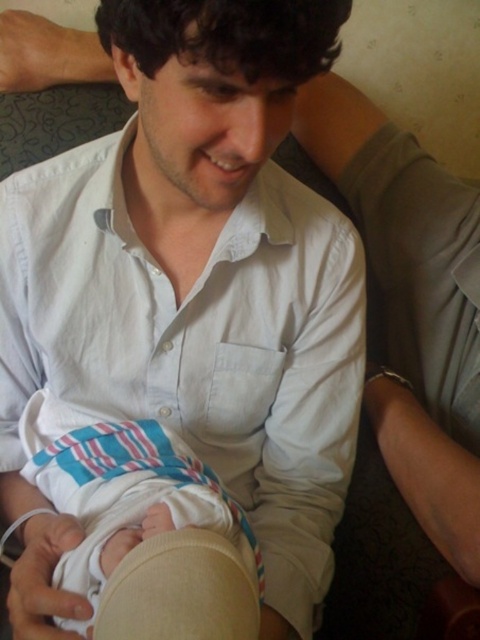
Question: In this image, where is white cotton shirt at center located relative to striped cotton diaper at center?

Choices:
 (A) left
 (B) right

Answer: (B)

Question: Does white cotton shirt at center appear under striped cotton diaper at center?

Choices:
 (A) yes
 (B) no

Answer: (B)

Question: Which object appears closest to the camera in this image?

Choices:
 (A) white cotton shirt at center
 (B) striped cotton diaper at center

Answer: (B)

Question: From the image, what is the correct spatial relationship of white cotton shirt at center in relation to striped cotton diaper at center?

Choices:
 (A) right
 (B) left

Answer: (A)